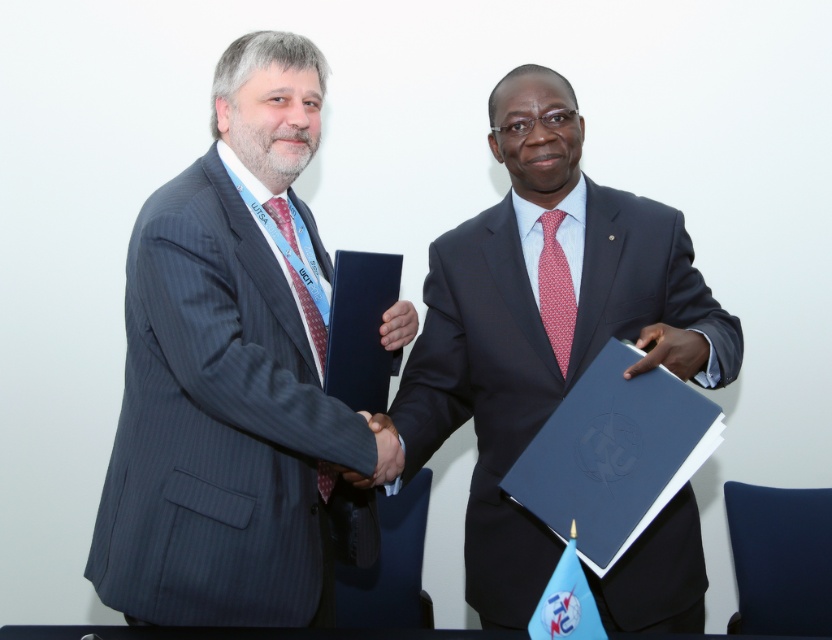
You are standing in front of the scene and want to determine which of the two points, point [660,292] or point [546,317], is closer to you. Based on the spatial arrangement, which point is nearer?

Point [660,292] is further to the viewer than point [546,317], so the closer point is point [546,317].

You are a photographer at an event and need to position your camera so that both the matte black suit at center and the red dotted fabric tie at center are in frame. Based on their positions, which object should you focus on first to ensure both are visible?

The matte black suit at center is to the right of the red dotted fabric tie at center. To ensure both are visible in the frame, focus on the red dotted fabric tie at center first, then adjust the camera to include the matte black suit at center to the right of it.

You are a photographer trying to capture a closeup of both the red dotted fabric tie at center and the matte red tie at left. Which tie should you focus on first to ensure it is in sharp focus?

You should focus on the red dotted fabric tie at center first because it is closer to you than the matte red tie at left, so it will be in focus before adjusting for the other.